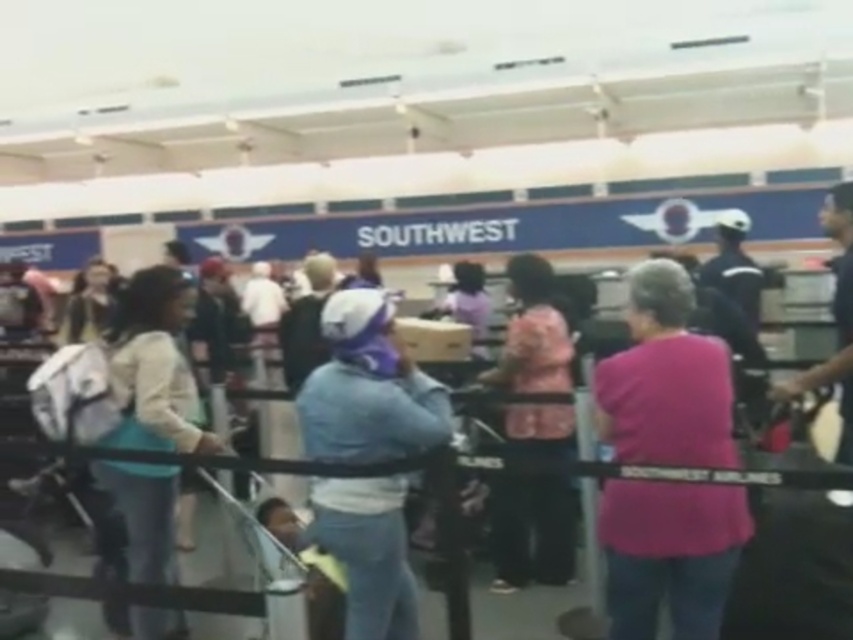
Between point (392, 410) and point (515, 298), which one is positioned behind?

The point (515, 298) is more distant.

Can you confirm if purple fleece hat at center is thinner than pink fabric purse at center?

No, purple fleece hat at center is not thinner than pink fabric purse at center.

Is point (408, 429) closer to camera compared to point (537, 426)?

Yes, point (408, 429) is closer to viewer.

Find the location of `purple fleece hat at center`. purple fleece hat at center is located at coordinates (368, 388).

Between pink fabric shirt at center and pink fabric purse at center, which one is positioned lower?

pink fabric purse at center

In the scene shown: Does pink fabric shirt at center lie in front of pink fabric purse at center?

Yes, pink fabric shirt at center is in front of pink fabric purse at center.

At what (x,y) coordinates should I click in order to perform the action: click on pink fabric shirt at center. Please return your answer as a coordinate pair (x, y). Image resolution: width=853 pixels, height=640 pixels. Looking at the image, I should click on (665, 378).

Can you confirm if pink fabric purse at center is taller than light brown leather jacket at center?

Yes.

Which is more to the left, pink fabric purse at center or light brown leather jacket at center?

light brown leather jacket at center is more to the left.

The width and height of the screenshot is (853, 640). What do you see at coordinates (527, 531) in the screenshot?
I see `pink fabric purse at center` at bounding box center [527, 531].

The image size is (853, 640). Find the location of `pink fabric purse at center`. pink fabric purse at center is located at coordinates (527, 531).